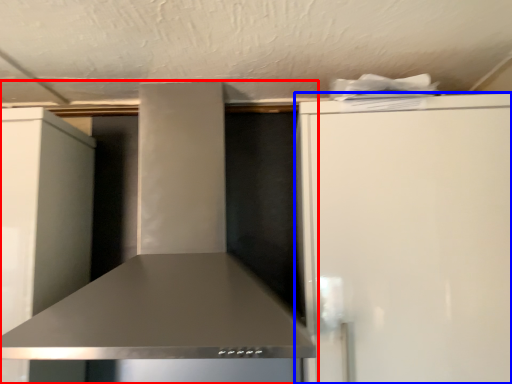
Question: Which of the following is the farthest to the observer, home appliance (highlighted by a red box) or refrigerator (highlighted by a blue box)?

Choices:
 (A) home appliance
 (B) refrigerator

Answer: (B)